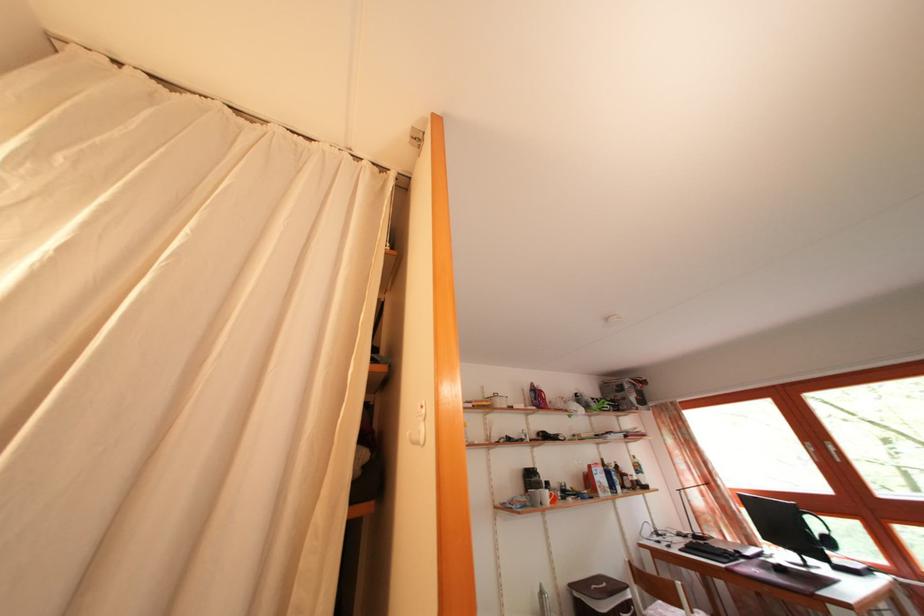
Find where to pull the silver window handle. Please return your answer as a coordinate pair (x, y).

(419, 427)